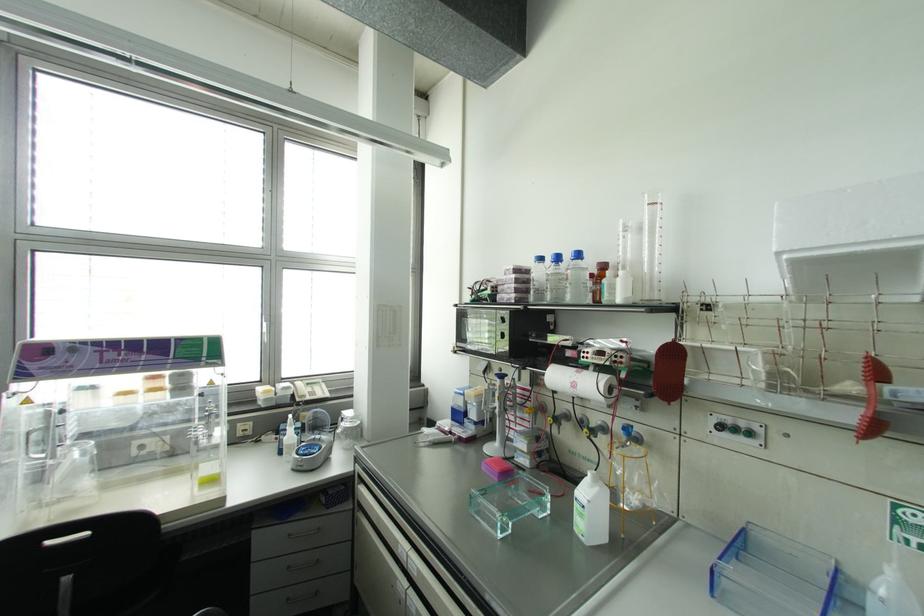
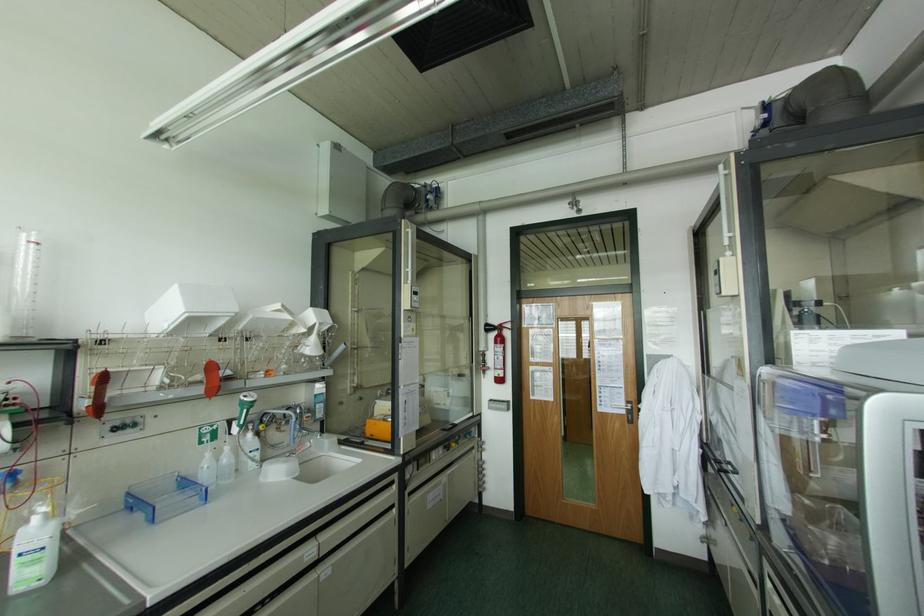
In the second image, find the point that corresponds to point (879, 371) in the first image.

(211, 368)